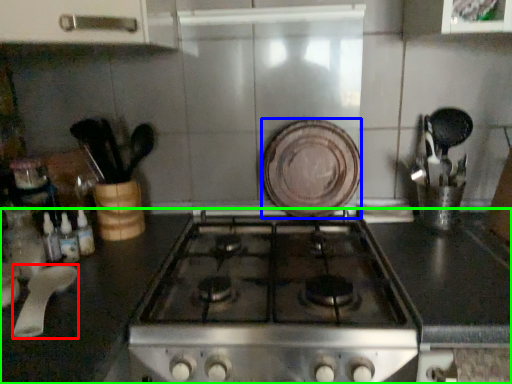
Question: Which object is the farthest from kitchen appliance (highlighted by a red box)? Choose among these: plate (highlighted by a blue box) or countertop (highlighted by a green box).

Choices:
 (A) plate
 (B) countertop

Answer: (A)